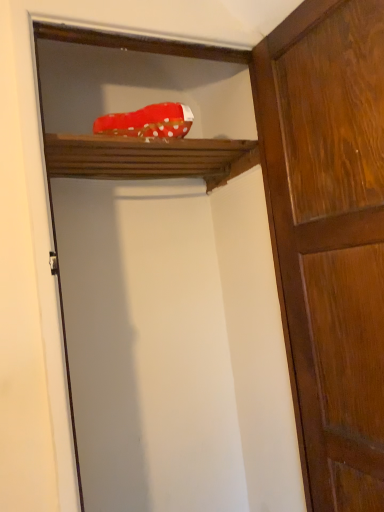
Find the location of a particular element. The image size is (384, 512). wooden shelf at upper center is located at coordinates (148, 158).

How many degrees apart are the facing directions of wooden shelf at upper center and shiny brown wood door at right?

They differ by 90.8 degrees in their facing directions.

From the image's perspective, between wooden shelf at upper center and shiny brown wood door at right, who is located below?

shiny brown wood door at right.

Considering the positions of objects wooden shelf at upper center and shiny brown wood door at right in the image provided, who is more to the right, wooden shelf at upper center or shiny brown wood door at right?

shiny brown wood door at right.

Considering the sizes of shiny brown wood door at right and red polka dot fabric at upper center in the image, is shiny brown wood door at right taller or shorter than red polka dot fabric at upper center?

shiny brown wood door at right is taller than red polka dot fabric at upper center.

The image size is (384, 512). In order to click on door located on the right of red polka dot fabric at upper center in this screenshot , I will do `click(329, 236)`.

Is shiny brown wood door at right turned away from red polka dot fabric at upper center?

That's not correct — shiny brown wood door at right is not looking away from red polka dot fabric at upper center.

Is shiny brown wood door at right wider or thinner than red polka dot fabric at upper center?

In the image, shiny brown wood door at right appears to be more narrow than red polka dot fabric at upper center.

In terms of width, does red polka dot fabric at upper center look wider or thinner when compared to shiny brown wood door at right?

In the image, red polka dot fabric at upper center appears to be wider than shiny brown wood door at right.

Is there a large distance between red polka dot fabric at upper center and shiny brown wood door at right?

No, red polka dot fabric at upper center is not far from shiny brown wood door at right.

Which is behind, point (94, 121) or point (325, 174)?

Point (94, 121)

Looking at this image, from a real-world perspective, is red polka dot fabric at upper center below shiny brown wood door at right?

No, from a real-world perspective, red polka dot fabric at upper center is not below shiny brown wood door at right.

Considering the relative positions of wooden shelf at upper center and red polka dot fabric at upper center in the image provided, is wooden shelf at upper center to the left or to the right of red polka dot fabric at upper center?

wooden shelf at upper center is to the left of red polka dot fabric at upper center.

Which object is wider, wooden shelf at upper center or red polka dot fabric at upper center?

wooden shelf at upper center.

Considering the relative sizes of wooden shelf at upper center and red polka dot fabric at upper center in the image provided, is wooden shelf at upper center bigger than red polka dot fabric at upper center?

Yes.

From a real-world perspective, which object stands above the other?

red polka dot fabric at upper center is physically above.

From the picture: Does red polka dot fabric at upper center turn towards wooden shelf at upper center?

No, red polka dot fabric at upper center is not oriented towards wooden shelf at upper center.

Choose the correct answer: Is red polka dot fabric at upper center inside wooden shelf at upper center or outside it?

red polka dot fabric at upper center is not inside wooden shelf at upper center, it's outside.

Is red polka dot fabric at upper center positioned behind wooden shelf at upper center?

No, red polka dot fabric at upper center is in front of wooden shelf at upper center.

Is red polka dot fabric at upper center at the left side of wooden shelf at upper center?

In fact, red polka dot fabric at upper center is to the right of wooden shelf at upper center.

From a real-world perspective, is shiny brown wood door at right over wooden shelf at upper center?

Actually, shiny brown wood door at right is physically below wooden shelf at upper center in the real world.

Looking at this image, does shiny brown wood door at right turn towards wooden shelf at upper center?

No, shiny brown wood door at right is not oriented towards wooden shelf at upper center.

Does shiny brown wood door at right touch wooden shelf at upper center?

There is a gap between shiny brown wood door at right and wooden shelf at upper center.

This screenshot has width=384, height=512. There is a shiny brown wood door at right. What are the coordinates of `shelf above it (from a real-world perspective)` in the screenshot? It's located at (148, 158).

This screenshot has height=512, width=384. Identify the location of door located on the right of red polka dot fabric at upper center. (329, 236).

Looking at the image, which one is located closer to red polka dot fabric at upper center, wooden shelf at upper center or shiny brown wood door at right?

wooden shelf at upper center.

Estimate the real-world distances between objects in this image. Which object is further from wooden shelf at upper center, red polka dot fabric at upper center or shiny brown wood door at right?

shiny brown wood door at right lies further to wooden shelf at upper center than the other object.

Considering their positions, is red polka dot fabric at upper center positioned closer to shiny brown wood door at right than wooden shelf at upper center?

Based on the image, wooden shelf at upper center appears to be nearer to shiny brown wood door at right.

Based on their spatial positions, is wooden shelf at upper center or red polka dot fabric at upper center further from shiny brown wood door at right?

red polka dot fabric at upper center.

Considering their positions, is shiny brown wood door at right positioned further to wooden shelf at upper center than red polka dot fabric at upper center?

shiny brown wood door at right lies further to wooden shelf at upper center than the other object.

Considering their positions, is shiny brown wood door at right positioned further to red polka dot fabric at upper center than wooden shelf at upper center?

shiny brown wood door at right lies further to red polka dot fabric at upper center than the other object.

You are a GUI agent. You are given a task and a screenshot of the screen. Output one action in this format:
    pyautogui.click(x=<x>, y=<y>)
    Task: Click on the material situated between wooden shelf at upper center and shiny brown wood door at right from left to right
    
    Given the screenshot: What is the action you would take?
    pyautogui.click(x=148, y=122)